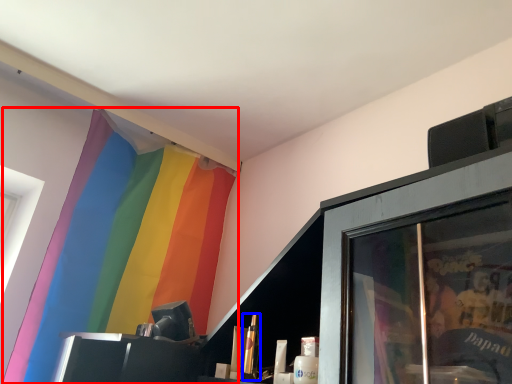
Question: Which of the following is the closest to the observer, curtain (highlighted by a red box) or toiletry (highlighted by a blue box)?

Choices:
 (A) curtain
 (B) toiletry

Answer: (B)